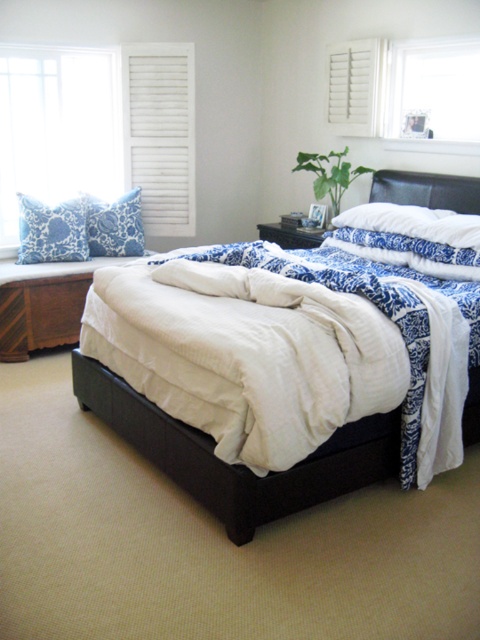
You are an interior designer assessing the bedroom layout. You need to determine if the white wood shutters at upper left can be replaced with wider shutters without affecting the matte black bed at center. Based on their current widths, what is your recommendation?

The white wood shutters at upper left currently have a lesser width compared to matte black bed at center. Since the shutters are narrower, replacing them with wider ones might require more space, potentially impacting the placement of the matte black bed at center. It is recommended to check the available space before proceeding.

You are standing at the center of the bedroom and looking towards the bed. There is a point marked at coordinates point (160, 132). What object is located at that point?

The white wood shutter at upper left is located at point (160, 132).